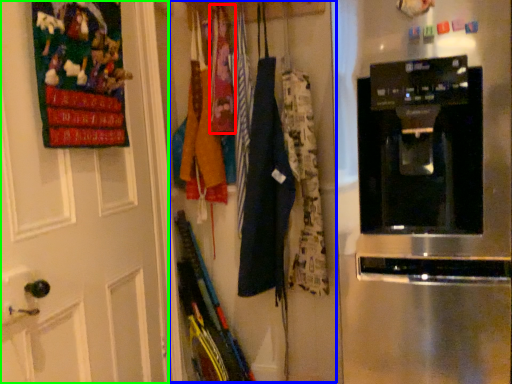
Question: Which object is the farthest from clothing (highlighted by a red box)? Choose among these: closet (highlighted by a blue box) or door (highlighted by a green box).

Choices:
 (A) closet
 (B) door

Answer: (B)